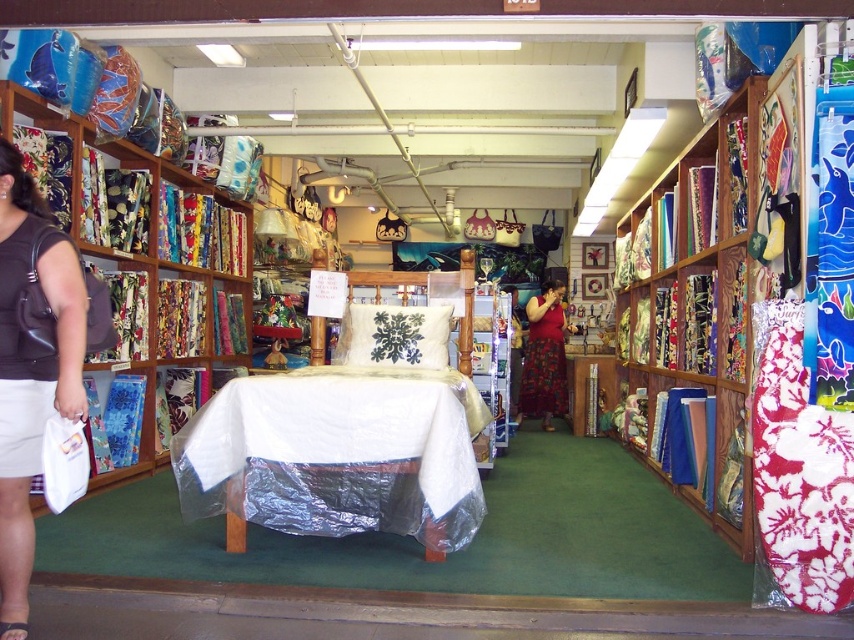
What do you see at coordinates (336, 454) in the screenshot? I see `white plastic table at center` at bounding box center [336, 454].

Is point (349, 387) farther from viewer compared to point (3, 388)?

Yes, it is.

The width and height of the screenshot is (854, 640). What do you see at coordinates (336, 454) in the screenshot? I see `white plastic table at center` at bounding box center [336, 454].

Identify the location of white plastic table at center. (336, 454).

Does white plastic table at center lie behind red satin dress at center?

No, white plastic table at center is closer to the viewer.

Is white plastic table at center positioned in front of red satin dress at center?

Yes, it is.

Which is behind, point (252, 468) or point (557, 314)?

Point (557, 314)

Locate an element on the screen. white plastic table at center is located at coordinates (336, 454).

Between multicolored fabric at right and red satin dress at center, which one has more height?

With more height is multicolored fabric at right.

Can you confirm if multicolored fabric at right is shorter than red satin dress at center?

In fact, multicolored fabric at right may be taller than red satin dress at center.

I want to click on multicolored fabric at right, so click(x=700, y=301).

Where is `multicolored fabric at right`? Image resolution: width=854 pixels, height=640 pixels. multicolored fabric at right is located at coordinates (700, 301).